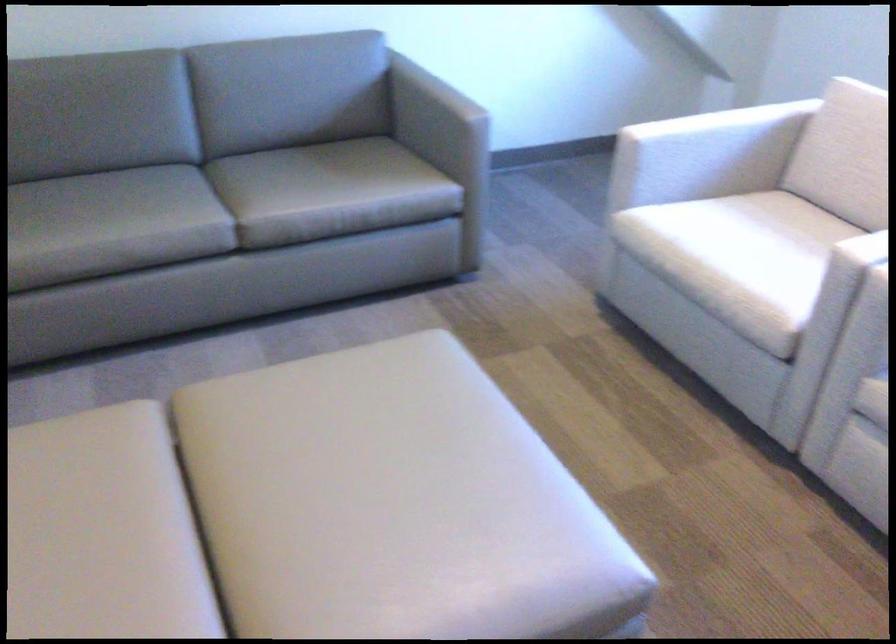
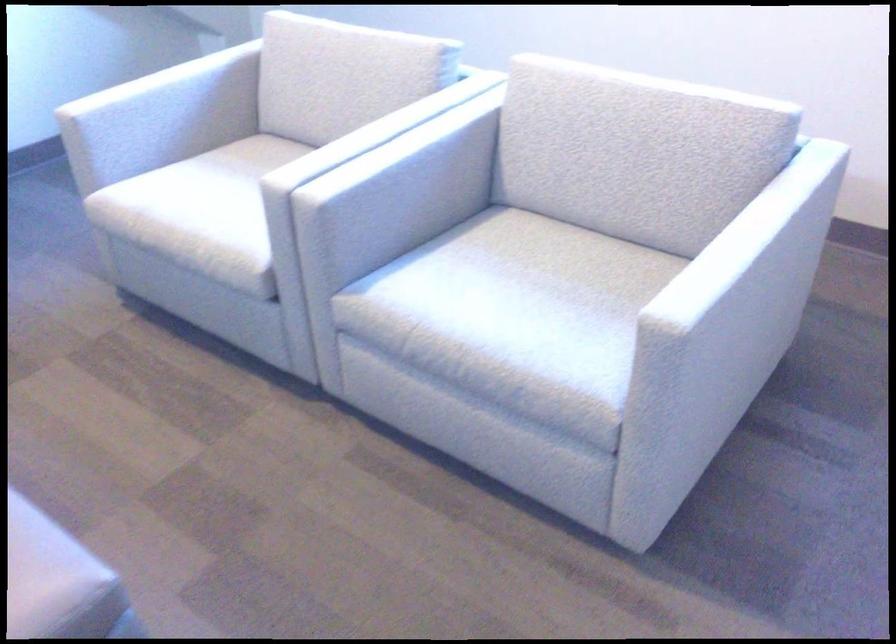
In the second image, find the point that corresponds to point (748, 243) in the first image.

(220, 196)